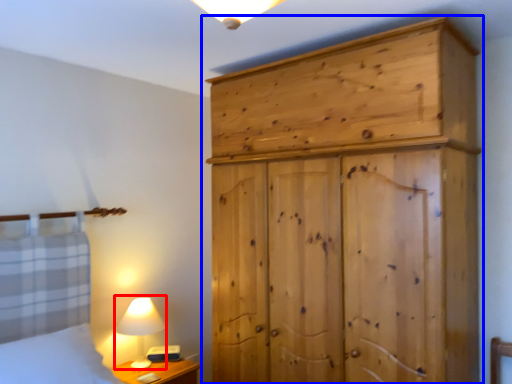
Question: Which point is closer to the camera, table lamp (highlighted by a red box) or cupboard (highlighted by a blue box)?

Choices:
 (A) table lamp
 (B) cupboard

Answer: (B)